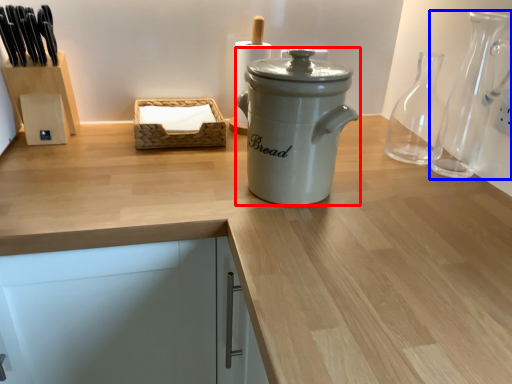
Question: Among these objects, which one is nearest to the camera, kitchen appliance (highlighted by a red box) or glass vase (highlighted by a blue box)?

Choices:
 (A) kitchen appliance
 (B) glass vase

Answer: (A)